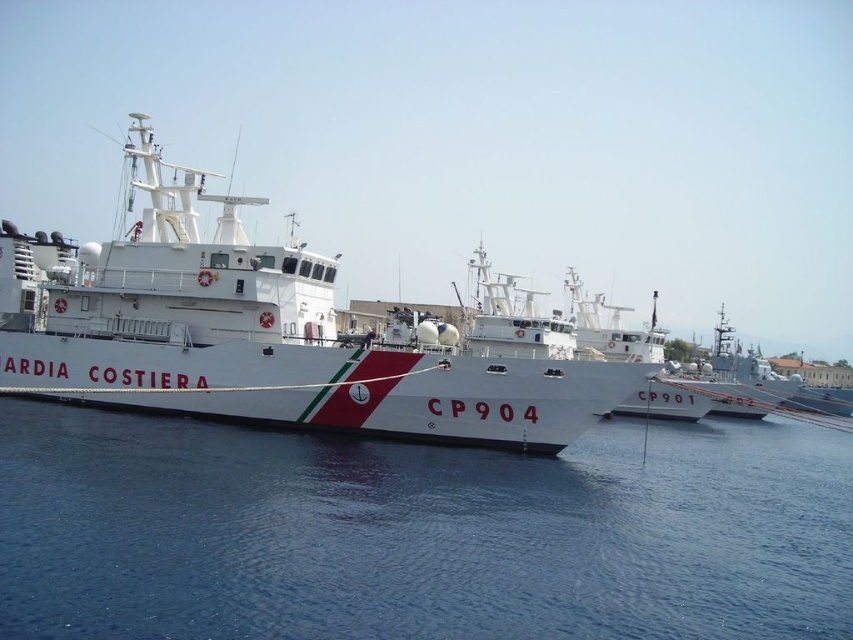
Does blue water at lower left have a greater height compared to white glossy ship at center?

No, blue water at lower left is not taller than white glossy ship at center.

Identify the location of blue water at lower left. (418, 532).

Between point (265, 460) and point (117, 346), which one is positioned behind?

Point (117, 346)

At what (x,y) coordinates should I click in order to perform the action: click on blue water at lower left. Please return your answer as a coordinate pair (x, y). Looking at the image, I should click on (418, 532).